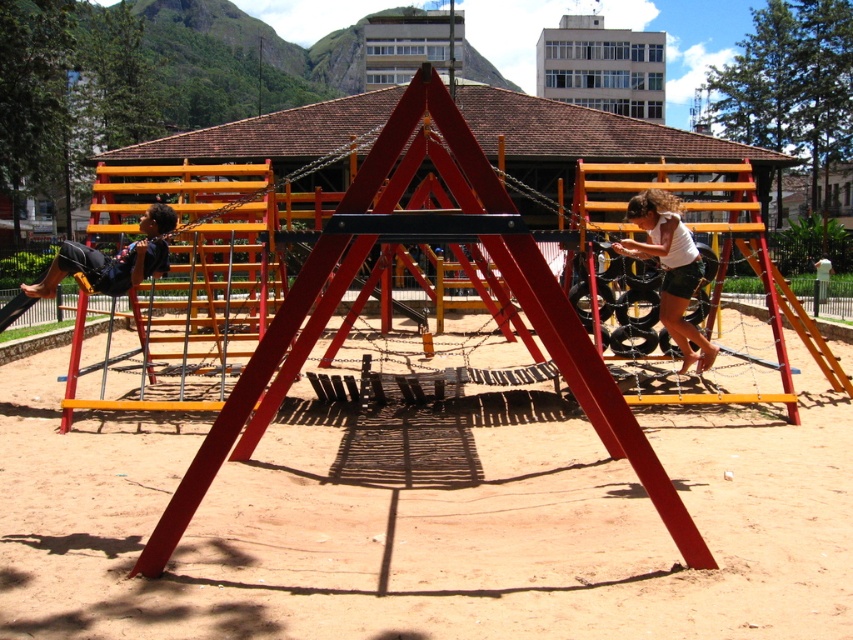
Question: Can you confirm if white cotton shirt at upper right is thinner than matte black shorts at left?

Choices:
 (A) no
 (B) yes

Answer: (A)

Question: Which of the following is the closest to the observer?

Choices:
 (A) 161,256
 (B) 683,349

Answer: (A)

Question: Is white cotton shirt at upper right smaller than matte black shorts at left?

Choices:
 (A) no
 (B) yes

Answer: (A)

Question: Which of the following is the farthest from the observer?

Choices:
 (A) (680, 273)
 (B) (44, 284)

Answer: (A)

Question: Does white cotton shirt at upper right appear on the left side of matte black shorts at left?

Choices:
 (A) no
 (B) yes

Answer: (A)